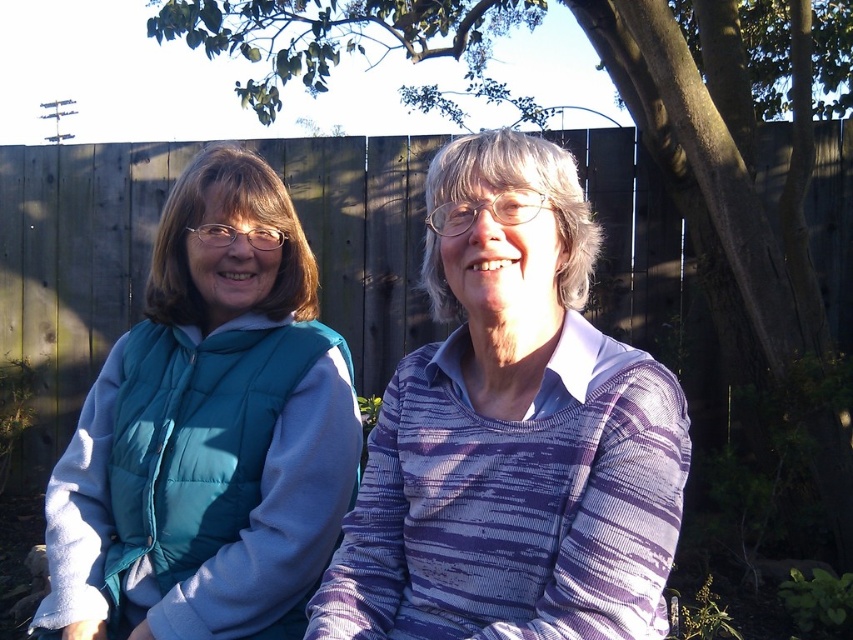
You are a photographer trying to capture a clear shot of the striped sweater at center and the teal puffer vest at left. Which item is closer to the camera?

The striped sweater at center is closer to the camera because it is in front of the teal puffer vest at left.

You are a fashion designer observing two people in a garden. You notice the striped sweater at center and the teal puffer vest at left. Which clothing item is positioned higher in the image?

The striped sweater at center is located above the teal puffer vest at left, so it is positioned higher in the image.